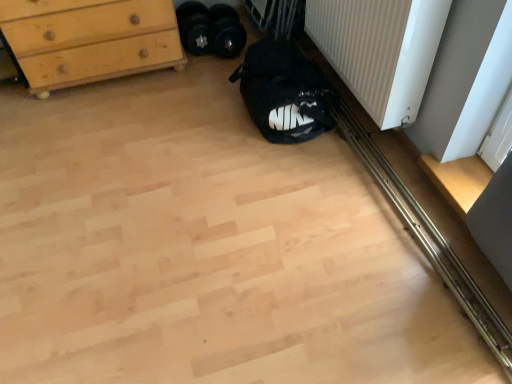
The height and width of the screenshot is (384, 512). Find the location of `free space in front of light wood chest of drawers at upper left`. free space in front of light wood chest of drawers at upper left is located at coordinates (100, 126).